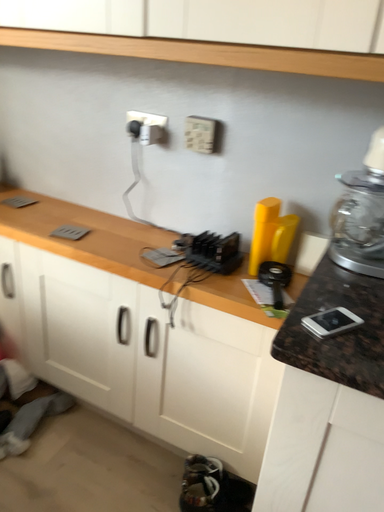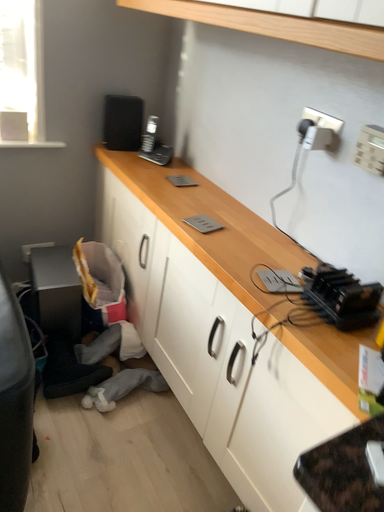
Question: How did the camera likely rotate when shooting the video?

Choices:
 (A) rotated right
 (B) rotated left

Answer: (B)